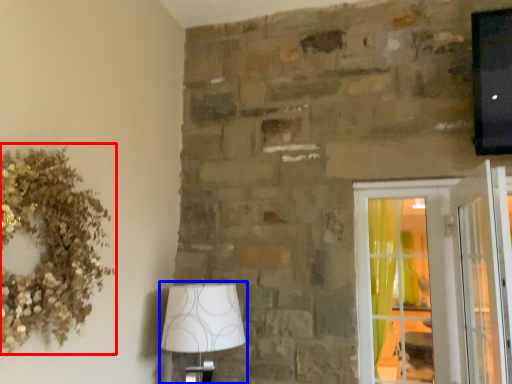
Question: Which of the following is the closest to the observer, floral arrangement (highlighted by a red box) or lamp (highlighted by a blue box)?

Choices:
 (A) floral arrangement
 (B) lamp

Answer: (A)